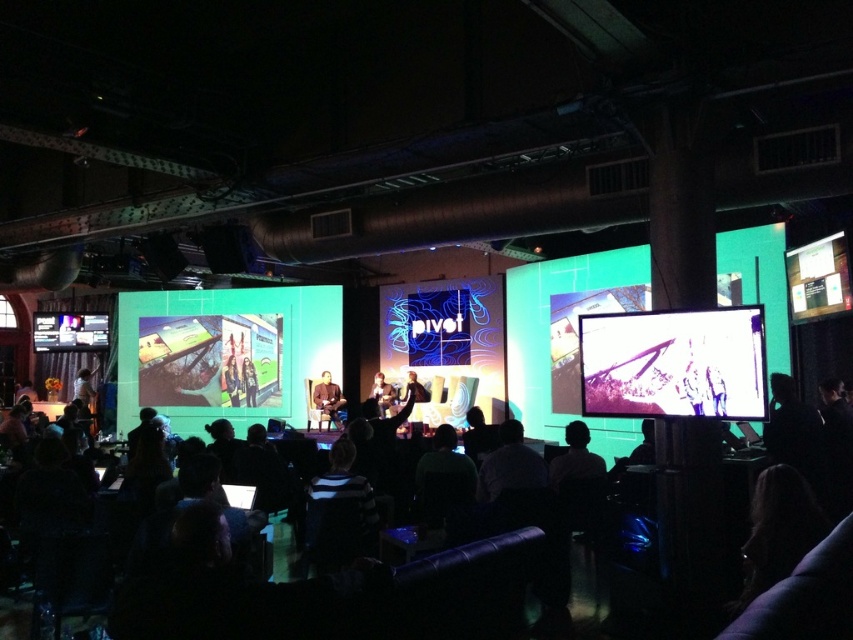
Question: Is dark clothing crowd at lower left thinner than metallic silver laptop at center?

Choices:
 (A) yes
 (B) no

Answer: (B)

Question: From the image, what is the correct spatial relationship of smooth leather jacket at center in relation to smooth skin person at center?

Choices:
 (A) right
 (B) left

Answer: (B)

Question: In this image, where is matte green screen at left located relative to metallic silver laptop at center?

Choices:
 (A) below
 (B) above

Answer: (A)

Question: Which object is farther from the camera taking this photo?

Choices:
 (A) dark clothing crowd at lower left
 (B) white glossy projection screen at center

Answer: (B)

Question: Considering the real-world distances, which object is farthest from the metallic silver laptop at center?

Choices:
 (A) smooth leather jacket at center
 (B) dark clothing crowd at lower left
 (C) matte green screen at left

Answer: (C)

Question: Which object is positioned farthest from the white glossy projection screen at center?

Choices:
 (A) metallic silver laptop at center
 (B) smooth skin person at center
 (C) dark clothing crowd at lower left

Answer: (C)